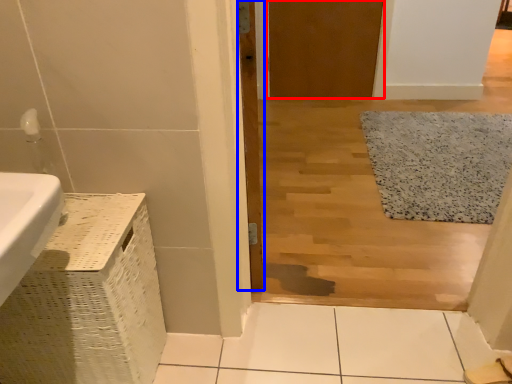
Question: Among these objects, which one is farthest to the camera, door (highlighted by a red box) or door (highlighted by a blue box)?

Choices:
 (A) door
 (B) door

Answer: (A)